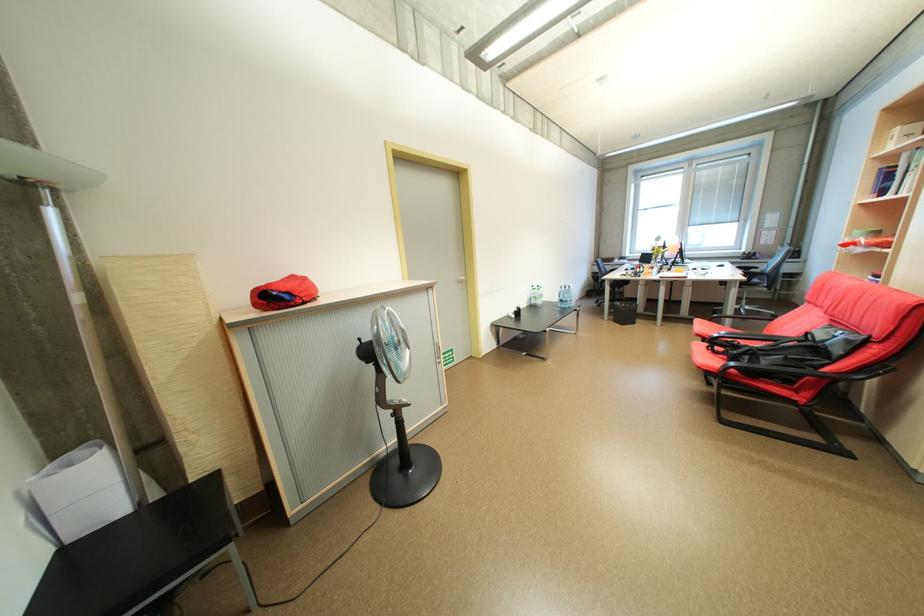
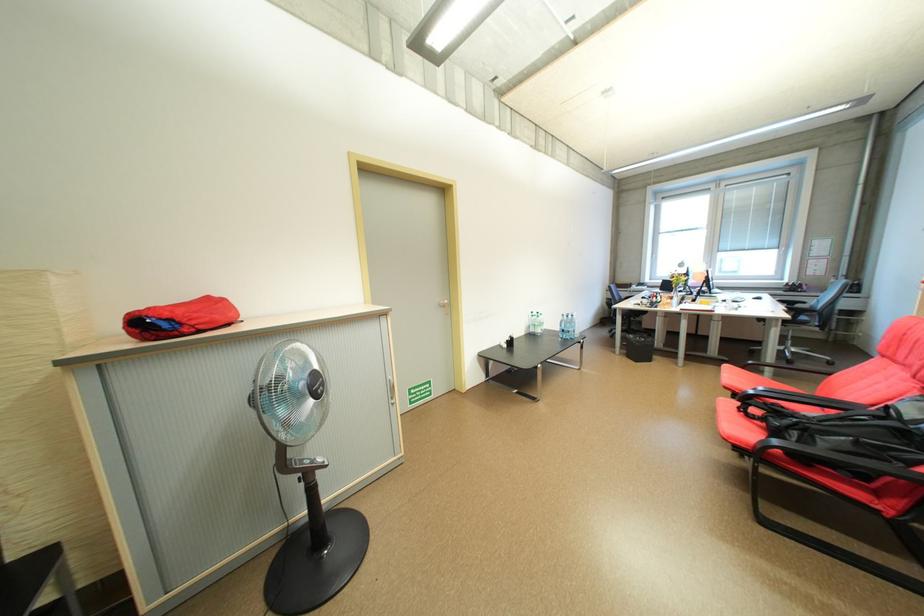
Where in the second image is the point corresponding to [618,315] from the first image?

(630, 349)